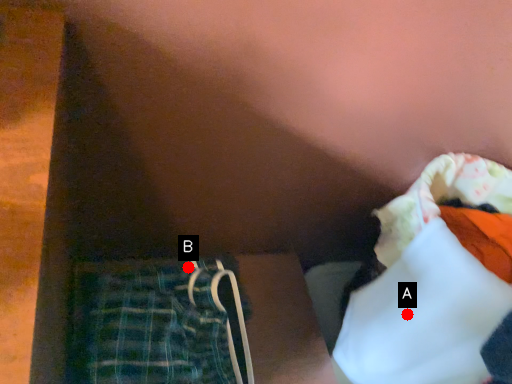
Question: Two points are circled on the image, labeled by A and B beside each circle. Which of the following is the farthest from the observer?

Choices:
 (A) A is further
 (B) B is further

Answer: (B)